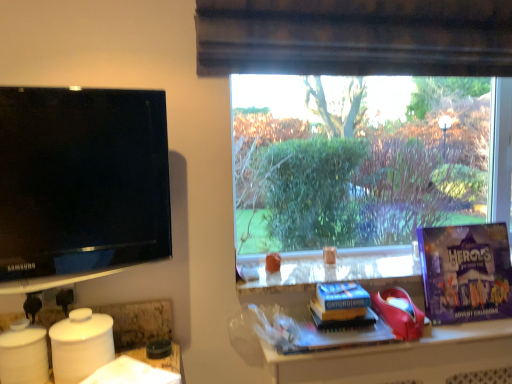
What do you see at coordinates (466, 272) in the screenshot? This screenshot has height=384, width=512. I see `purple cardboard advent calendar at right, which is counted as the first paperback book, starting from the top` at bounding box center [466, 272].

This screenshot has width=512, height=384. What do you see at coordinates (336, 332) in the screenshot?
I see `hardcover book at center, acting as the second book starting from the top` at bounding box center [336, 332].

This screenshot has width=512, height=384. What do you see at coordinates (81, 184) in the screenshot?
I see `matte black tv at left` at bounding box center [81, 184].

Identify the location of blue paper at center, placed as the 2th paperback book when sorted from right to left. (340, 301).

At what (x,y) coordinates should I click in order to perform the action: click on paperback book that is the 2nd object directly below the matte black tv at left (from a real-world perspective). Please return your answer as a coordinate pair (x, y). The height and width of the screenshot is (384, 512). Looking at the image, I should click on (340, 301).

From the image's perspective, does blue paper at center, the 1th paperback book from the left, appear lower than matte black tv at left?

Yes, from the image's perspective, blue paper at center, the 1th paperback book from the left, is beneath matte black tv at left.

Can you confirm if blue paper at center, which ranks as the 2th paperback book in top-to-bottom order, is taller than matte black tv at left?

Incorrect, the height of blue paper at center, which ranks as the 2th paperback book in top-to-bottom order, is not larger of that of matte black tv at left.

Based on the photo, from the image's perspective, between blue paper at center, placed as the 2th paperback book when sorted from right to left, and hardcover book at center, marked as the first book in a bottom-to-top arrangement, which one is located above?

blue paper at center, placed as the 2th paperback book when sorted from right to left.

Does point (345, 290) appear closer or farther from the camera than point (372, 320)?

Point (345, 290) appears to be farther away from the viewer than point (372, 320).

Looking at this image, which is behind, blue paper at center, which is the 1th paperback book from bottom to top, or hardcover book at center, acting as the second book starting from the top?

blue paper at center, which is the 1th paperback book from bottom to top.

Does purple cardboard advent calendar at right, which is the second paperback book from left to right, have a greater height compared to matte black tv at left?

No, purple cardboard advent calendar at right, which is the second paperback book from left to right, is not taller than matte black tv at left.

Does purple cardboard advent calendar at right, marked as the second paperback book in a bottom-to-top arrangement, have a larger size compared to matte black tv at left?

Yes.

How many degrees apart are the facing directions of purple cardboard advent calendar at right, which is the second paperback book from left to right, and matte black tv at left?

The facing directions of purple cardboard advent calendar at right, which is the second paperback book from left to right, and matte black tv at left are 11.5 degrees apart.

Which object is further away from the camera, purple cardboard advent calendar at right, which is counted as the first paperback book, starting from the top, or matte black tv at left?

purple cardboard advent calendar at right, which is counted as the first paperback book, starting from the top, is more distant.

Is point (457, 243) in front of point (283, 353)?

No, it is not.

From the image's perspective, which one is positioned higher, purple cardboard advent calendar at right, marked as the second paperback book in a bottom-to-top arrangement, or hardcover book at center, marked as the first book in a bottom-to-top arrangement?

purple cardboard advent calendar at right, marked as the second paperback book in a bottom-to-top arrangement, is shown above in the image.

Can you confirm if purple cardboard advent calendar at right, which is counted as the first paperback book, starting from the top, is thinner than hardcover book at center, marked as the first book in a bottom-to-top arrangement?

Correct, the width of purple cardboard advent calendar at right, which is counted as the first paperback book, starting from the top, is less than that of hardcover book at center, marked as the first book in a bottom-to-top arrangement.

Consider the image. Is matte black tv at left positioned with its back to yellow matte book at center, marked as the second book in a bottom-to-top arrangement?

That's not correct — matte black tv at left is not looking away from yellow matte book at center, marked as the second book in a bottom-to-top arrangement.

Which is in front, matte black tv at left or yellow matte book at center, marked as the second book in a bottom-to-top arrangement?

matte black tv at left is more forward.

Does matte black tv at left appear on the left side of yellow matte book at center, the first book in the top-to-bottom sequence?

Indeed, matte black tv at left is positioned on the left side of yellow matte book at center, the first book in the top-to-bottom sequence.

Measure the distance between matte black tv at left and yellow matte book at center, marked as the second book in a bottom-to-top arrangement.

matte black tv at left and yellow matte book at center, marked as the second book in a bottom-to-top arrangement, are 33.58 inches apart from each other.

Which object is positioned more to the left, matte black tv at left or blue paper at center, which is the 1th paperback book from bottom to top?

matte black tv at left.

Would you say matte black tv at left contains blue paper at center, placed as the 2th paperback book when sorted from right to left?

No, blue paper at center, placed as the 2th paperback book when sorted from right to left, is not surrounded by matte black tv at left.

You are a GUI agent. You are given a task and a screenshot of the screen. Output one action in this format:
    pyautogui.click(x=<x>, y=<y>)
    Task: Click on the 2nd paperback book below the matte black tv at left (from a real-world perspective)
    
    Given the screenshot: What is the action you would take?
    pyautogui.click(x=340, y=301)

Is purple cardboard advent calendar at right, which is counted as the first paperback book, starting from the top, to the right of yellow matte book at center, marked as the second book in a bottom-to-top arrangement, from the viewer's perspective?

Indeed, purple cardboard advent calendar at right, which is counted as the first paperback book, starting from the top, is positioned on the right side of yellow matte book at center, marked as the second book in a bottom-to-top arrangement.

Consider the image. From the image's perspective, which object appears higher, purple cardboard advent calendar at right, which is the second paperback book from left to right, or yellow matte book at center, marked as the second book in a bottom-to-top arrangement?

purple cardboard advent calendar at right, which is the second paperback book from left to right, appears higher in the image.

Is purple cardboard advent calendar at right, which is the second paperback book from left to right, shorter than yellow matte book at center, the first book in the top-to-bottom sequence?

No.

Is point (482, 228) closer or farther from the camera than point (334, 324)?

Point (482, 228) appears to be farther away from the viewer than point (334, 324).

Identify the location of paperback book that is the 2nd one below the matte black tv at left (from a real-world perspective). (340, 301).

Which book is the 2nd one when counting from the right side of the blue paper at center, the 1th paperback book from the left? Please provide its 2D coordinates.

[(336, 332)]

Looking at the image, which one is located closer to purple cardboard advent calendar at right, the first paperback book positioned from the right, matte black tv at left or yellow matte book at center, marked as the second book in a bottom-to-top arrangement?

Among the two, yellow matte book at center, marked as the second book in a bottom-to-top arrangement, is located nearer to purple cardboard advent calendar at right, the first paperback book positioned from the right.

Estimate the real-world distances between objects in this image. Which object is further from hardcover book at center, marked as the first book in a bottom-to-top arrangement, yellow matte book at center, the first book in the top-to-bottom sequence, or purple cardboard advent calendar at right, marked as the second paperback book in a bottom-to-top arrangement?

Based on the image, purple cardboard advent calendar at right, marked as the second paperback book in a bottom-to-top arrangement, appears to be further to hardcover book at center, marked as the first book in a bottom-to-top arrangement.

Based on their spatial positions, is yellow matte book at center, the first book in the top-to-bottom sequence, or hardcover book at center, acting as the second book starting from the top, further from blue paper at center, placed as the 2th paperback book when sorted from right to left?

Based on the image, hardcover book at center, acting as the second book starting from the top, appears to be further to blue paper at center, placed as the 2th paperback book when sorted from right to left.

Which object lies further to the anchor point blue paper at center, which ranks as the 2th paperback book in top-to-bottom order, matte black tv at left or purple cardboard advent calendar at right, the first paperback book positioned from the right?

matte black tv at left lies further to blue paper at center, which ranks as the 2th paperback book in top-to-bottom order, than the other object.

From the image, which object appears to be farther from purple cardboard advent calendar at right, which is counted as the first paperback book, starting from the top, hardcover book at center, marked as the first book in a bottom-to-top arrangement, or yellow matte book at center, the first book in the top-to-bottom sequence?

Among the two, yellow matte book at center, the first book in the top-to-bottom sequence, is located further to purple cardboard advent calendar at right, which is counted as the first paperback book, starting from the top.

From the image, which object appears to be farther from yellow matte book at center, the first book in the top-to-bottom sequence, blue paper at center, the 1th paperback book from the left, or purple cardboard advent calendar at right, marked as the second paperback book in a bottom-to-top arrangement?

purple cardboard advent calendar at right, marked as the second paperback book in a bottom-to-top arrangement, is positioned further to the anchor yellow matte book at center, the first book in the top-to-bottom sequence.

Considering their positions, is hardcover book at center, marked as the first book in a bottom-to-top arrangement, positioned closer to blue paper at center, which ranks as the 2th paperback book in top-to-bottom order, than matte black tv at left?

Among the two, hardcover book at center, marked as the first book in a bottom-to-top arrangement, is located nearer to blue paper at center, which ranks as the 2th paperback book in top-to-bottom order.

Estimate the real-world distances between objects in this image. Which object is closer to matte black tv at left, yellow matte book at center, the first book in the top-to-bottom sequence, or hardcover book at center, acting as the second book starting from the top?

hardcover book at center, acting as the second book starting from the top.

Where is `paperback book situated between matte black tv at left and purple cardboard advent calendar at right, marked as the second paperback book in a bottom-to-top arrangement, from left to right`? The height and width of the screenshot is (384, 512). paperback book situated between matte black tv at left and purple cardboard advent calendar at right, marked as the second paperback book in a bottom-to-top arrangement, from left to right is located at coordinates (340, 301).

This screenshot has width=512, height=384. I want to click on paperback book between matte black tv at left and yellow matte book at center, marked as the second book in a bottom-to-top arrangement, from left to right, so click(340, 301).

Find the location of a particular element. The height and width of the screenshot is (384, 512). book situated between yellow matte book at center, the first book in the top-to-bottom sequence, and purple cardboard advent calendar at right, the first paperback book positioned from the right, from left to right is located at coordinates (336, 332).

What are the coordinates of `book between blue paper at center, which is the 1th paperback book from bottom to top, and hardcover book at center, marked as the first book in a bottom-to-top arrangement, from top to bottom` in the screenshot? It's located at (344, 321).